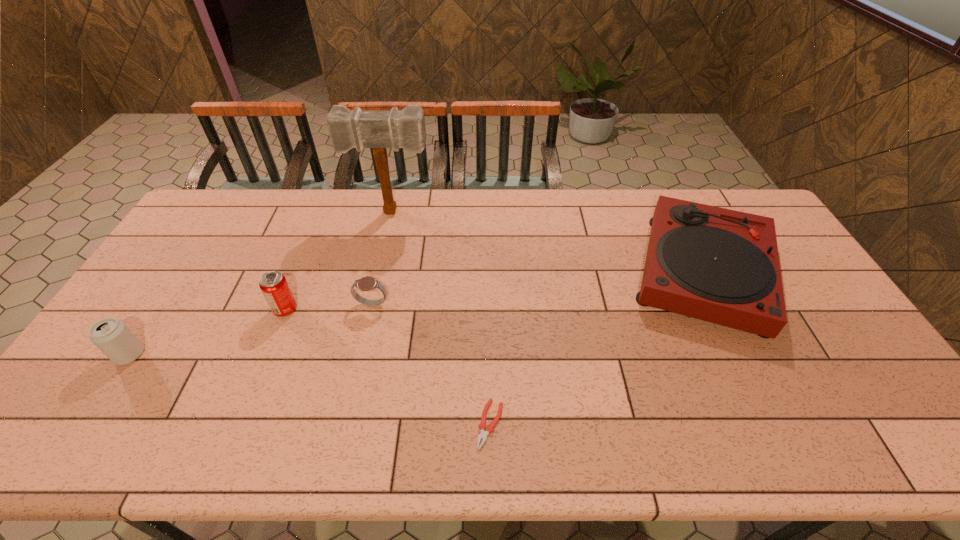
The width and height of the screenshot is (960, 540). I want to click on free space between the soda can and the fifth tallest object, so click(x=328, y=307).

This screenshot has width=960, height=540. Identify the location of empty space between the can and the soda can. (207, 332).

Where is `free space between the can and the watch`? free space between the can and the watch is located at coordinates (251, 329).

This screenshot has width=960, height=540. I want to click on object that is the fifth closest to the rightmost object, so click(110, 335).

Where is `the fourth closest object to the rightmost object`? The height and width of the screenshot is (540, 960). the fourth closest object to the rightmost object is located at coordinates (273, 284).

The width and height of the screenshot is (960, 540). I want to click on vacant space that satisfies the following two spatial constraints: 1. on the back side of the rightmost object; 2. on the left side of the can, so click(x=184, y=271).

Where is `free region that satisfies the following two spatial constraints: 1. on the front side of the mallet; 2. on the left side of the record player`? free region that satisfies the following two spatial constraints: 1. on the front side of the mallet; 2. on the left side of the record player is located at coordinates click(379, 271).

Image resolution: width=960 pixels, height=540 pixels. Identify the location of free spot that satisfies the following two spatial constraints: 1. on the front side of the record player; 2. on the left side of the mallet. (379, 271).

Find the location of `vacant space that satisfies the following two spatial constraints: 1. on the back side of the tallest object; 2. on the right side of the soda can`. vacant space that satisfies the following two spatial constraints: 1. on the back side of the tallest object; 2. on the right side of the soda can is located at coordinates (324, 212).